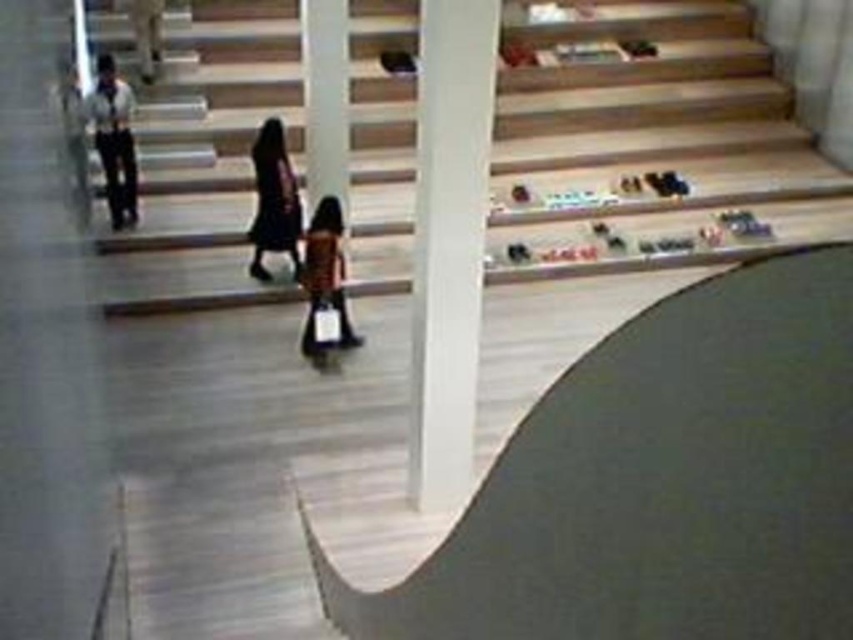
Can you confirm if dark purple dress at center is shorter than orange fabric bag at center?

Indeed, dark purple dress at center has a lesser height compared to orange fabric bag at center.

Which of these two, dark purple dress at center or orange fabric bag at center, stands taller?

Standing taller between the two is orange fabric bag at center.

Is point (271, 170) more distant than point (306, 237)?

Yes.

Identify the location of dark purple dress at center. Image resolution: width=853 pixels, height=640 pixels. (274, 200).

Is dark purple dress at center thinner than matte black jacket at upper left?

No.

Is dark purple dress at center taller than matte black jacket at upper left?

Correct, dark purple dress at center is much taller as matte black jacket at upper left.

Does point (251, 266) come behind point (142, 44)?

No, (251, 266) is closer to viewer.

Identify the location of dark purple dress at center. (274, 200).

Based on the photo, does white shirt at left appear over matte black jacket at upper left?

No.

Is white shirt at left closer to the viewer compared to matte black jacket at upper left?

Yes, it is.

Locate an element on the screen. The height and width of the screenshot is (640, 853). white shirt at left is located at coordinates point(114,140).